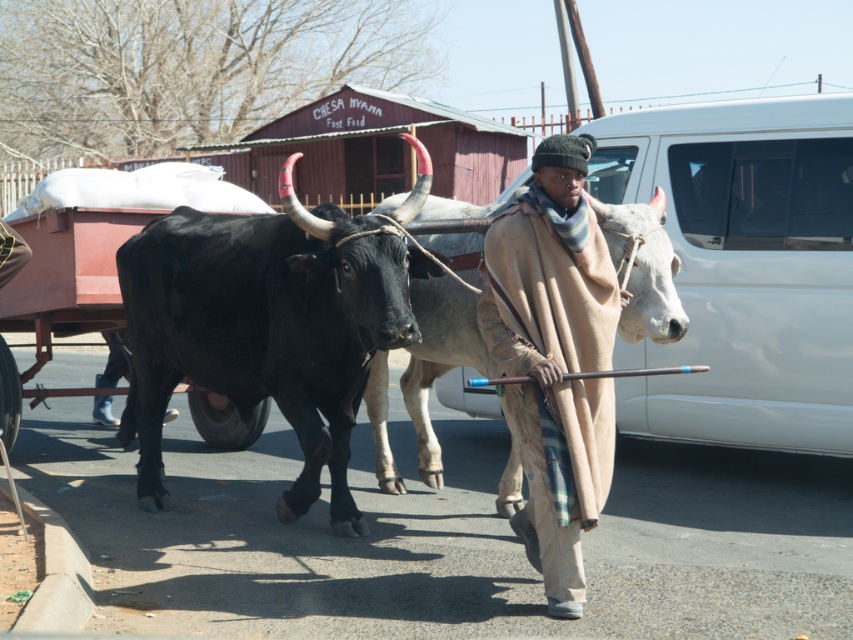
You are a photographer standing 5 meters away from the camera. You want to take a photo of the shiny black bull at center. Can you reach the bull within 10 meters from your current position?

The distance between the shiny black bull at center and the camera is 6.10 meters. Since you are 5 meters away from the camera, the total distance to the bull would be 5 meters plus 6.10 meters, totaling 11.10 meters. This exceeds the 10 meters limit, so you cannot reach the bull within 10 meters from your current position.

Where is the shiny black bull at center located in the image?

The shiny black bull at center is located at point coordinates of (265,328).